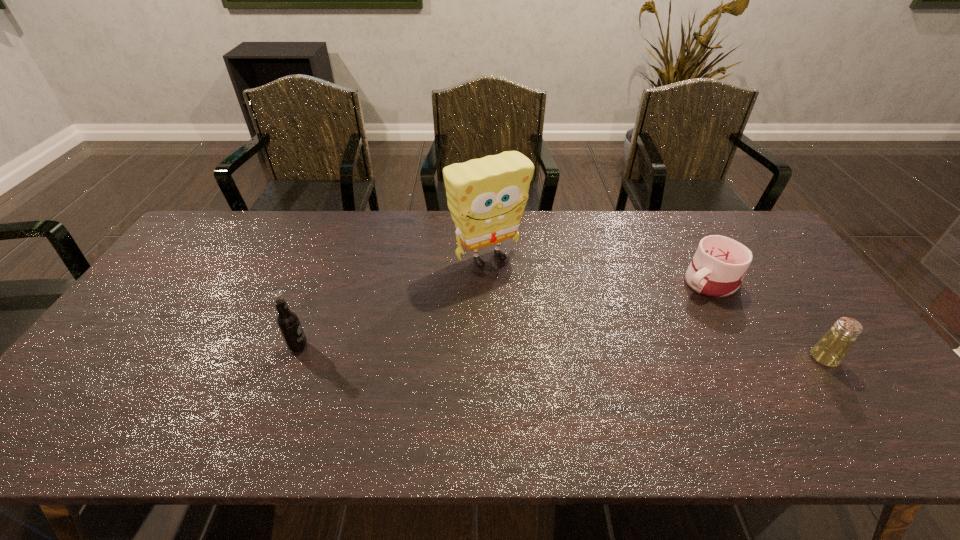
At what (x,y) coordinates should I click in order to perform the action: click on unoccupied position between the saltshaker and the leftmost object. Please return your answer as a coordinate pair (x, y). This screenshot has height=540, width=960. Looking at the image, I should click on (562, 353).

This screenshot has width=960, height=540. I want to click on free point between the tallest object and the rightmost object, so click(x=656, y=308).

Locate an element on the screen. free space between the third object from left to right and the saltshaker is located at coordinates (766, 319).

Identify the location of vacant area that lies between the second tallest object and the third object from right to left. The image size is (960, 540). (393, 302).

At what (x,y) coordinates should I click in order to perform the action: click on free spot between the rightmost object and the third object from right to left. Please return your answer as a coordinate pair (x, y). Looking at the image, I should click on (656, 308).

Find the location of a particular element. The image size is (960, 540). free space between the second tallest object and the mug is located at coordinates (504, 314).

Where is `vacant area that lies between the third object from right to left and the saltshaker`? Image resolution: width=960 pixels, height=540 pixels. vacant area that lies between the third object from right to left and the saltshaker is located at coordinates (656, 308).

Where is `vacant space that's between the saltshaker and the third shortest object`? This screenshot has width=960, height=540. vacant space that's between the saltshaker and the third shortest object is located at coordinates (562, 353).

At what (x,y) coordinates should I click in order to perform the action: click on empty space that is in between the second object from right to left and the root beer. Please return your answer as a coordinate pair (x, y). This screenshot has width=960, height=540. Looking at the image, I should click on (504, 314).

Identify the location of vacant area that lies between the rightmost object and the third shortest object. The image size is (960, 540). (562, 353).